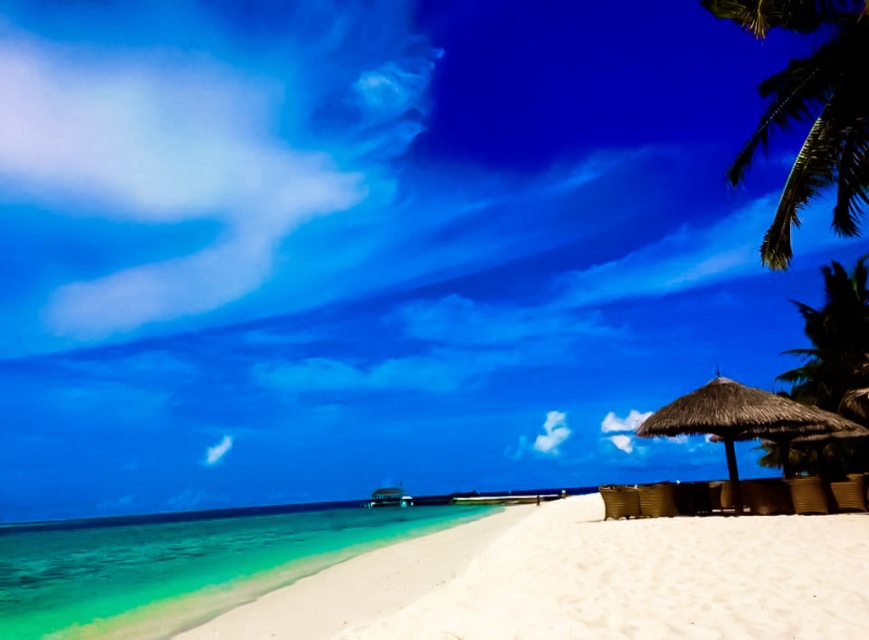
In order to click on clear water at lower left in this screenshot , I will do [x=180, y=564].

From the picture: Between clear water at lower left and green leafy palm tree at upper right, which one has less height?

With less height is green leafy palm tree at upper right.

Who is more forward, [76,627] or [785,212]?

Point [76,627] is more forward.

Where is `clear water at lower left`? Image resolution: width=869 pixels, height=640 pixels. clear water at lower left is located at coordinates (180, 564).

Does clear water at lower left appear on the right side of thatched straw umbrella at lower right?

No, clear water at lower left is not to the right of thatched straw umbrella at lower right.

Which is more to the left, clear water at lower left or thatched straw umbrella at lower right?

Positioned to the left is clear water at lower left.

Does point (18, 625) lie behind point (814, 413)?

No, (18, 625) is in front of (814, 413).

Where is `clear water at lower left`? The image size is (869, 640). clear water at lower left is located at coordinates (180, 564).

Does clear water at lower left have a smaller size compared to green leafy palm tree at right?

No.

Can you confirm if clear water at lower left is bigger than green leafy palm tree at right?

Correct, clear water at lower left is larger in size than green leafy palm tree at right.

Between point (109, 616) and point (844, 326), which one is positioned in front?

Point (109, 616)

Identify the location of clear water at lower left. (180, 564).